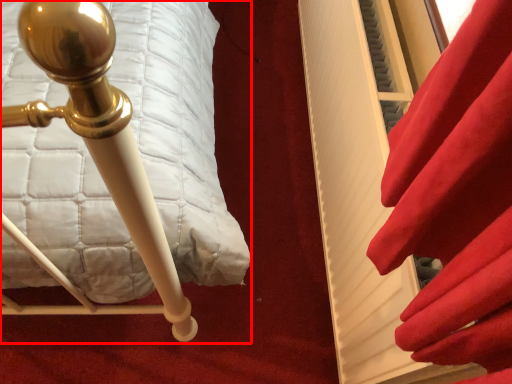
Question: From the image's perspective, where is furniture (annotated by the red box) located in relation to curtain in the image?

Choices:
 (A) below
 (B) above

Answer: (A)